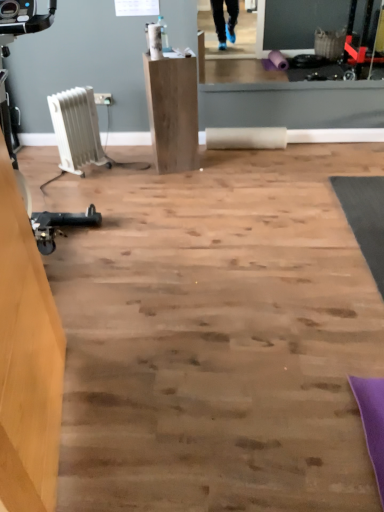
Identify the location of free space below wooden desk at left, the 1th furniture positioned from the bottom (from a real-world perspective). (66, 434).